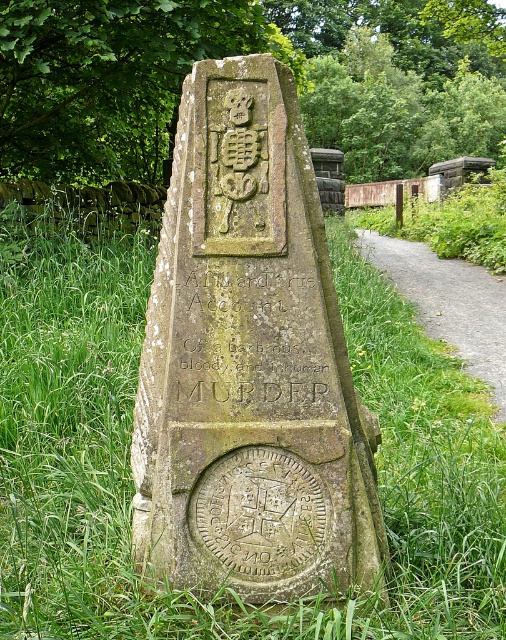
Based on the scene description, where is the green mossy stone monument at center located in terms of its 2D coordinates?

The green mossy stone monument at center is located at the 2D coordinates of point (x=249, y=362).

You are a hiker who wants to take a photo of the green mossy stone monument at center. You are standing on the gravel path at right. Can you fit the entire monument into your camera frame without moving? Explain why or why not based on their sizes.

The green mossy stone monument at center is bigger than the gravel path at right. Since you are standing on the gravel path at right, the monument is larger than your current position, so it might be challenging to fit the entire monument into the camera frame without moving closer or adjusting your angle.